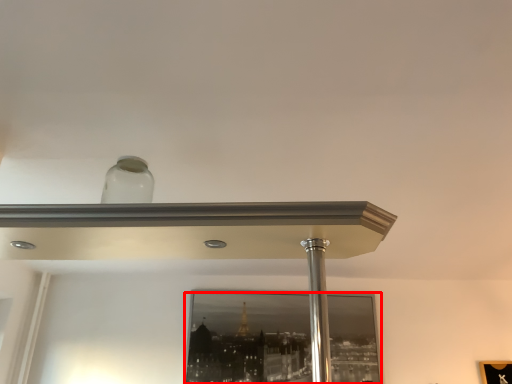
Question: From the image's perspective, where is mirror (annotated by the red box) located in relation to pillar in the image?

Choices:
 (A) above
 (B) below

Answer: (B)